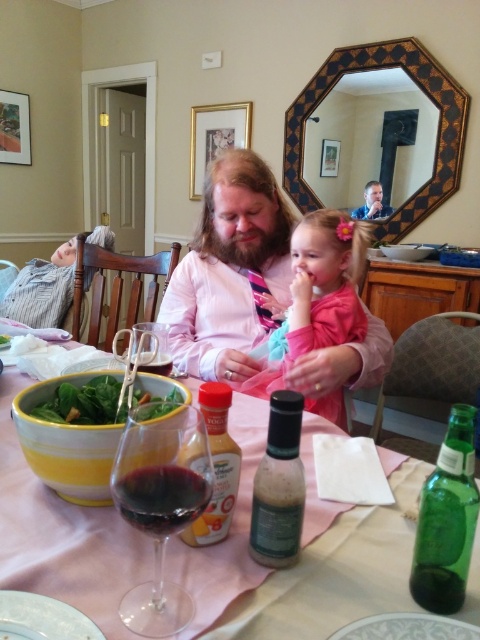
You are a guest at this dinner and want to pour yourself a drink. The transparent glass wine glass at center is on the table. There are two bottles available, one is the green glass bottle at lower right. Which bottle is taller and can fit more liquid?

The green glass bottle at lower right is taller than the transparent glass wine glass at center, so it can hold more liquid.

You are a guest at the table and want to reach for the transparent glass wine glass at center without knocking over the green glass bottle at lower right. Which object should you move first?

The transparent glass wine glass at center is in front of the green glass bottle at lower right, so you should move the transparent glass wine glass at center first to avoid knocking over the green glass bottle at lower right.

You are a guest at the table and want to reach for the green glass bottle at lower right without moving the green leafy salad at lower left. Which direction should you move your hand from the salad?

The green glass bottle at lower right is positioned on the right side of green leafy salad at lower left, so you should move your hand to the right from the salad to reach the bottle.